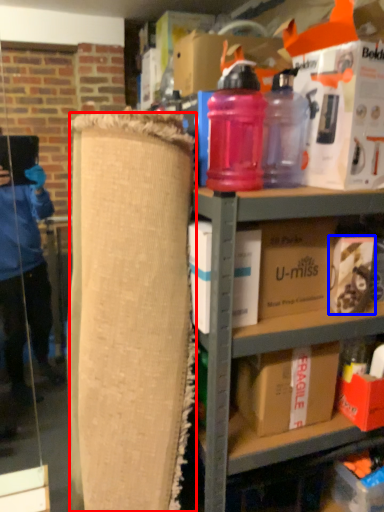
Question: Which object appears farthest to the camera in this image, plywood (highlighted by a red box) or box (highlighted by a blue box)?

Choices:
 (A) plywood
 (B) box

Answer: (B)